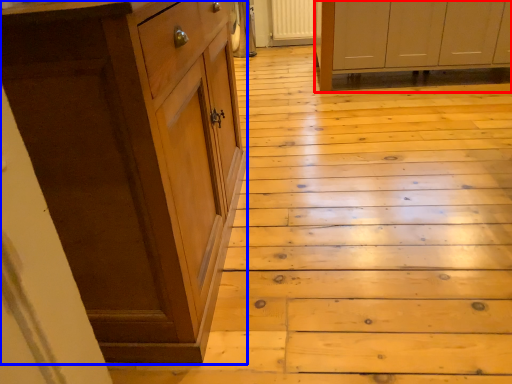
Question: Which object appears closest to the camera in this image, cabinetry (highlighted by a red box) or cabinetry (highlighted by a blue box)?

Choices:
 (A) cabinetry
 (B) cabinetry

Answer: (B)